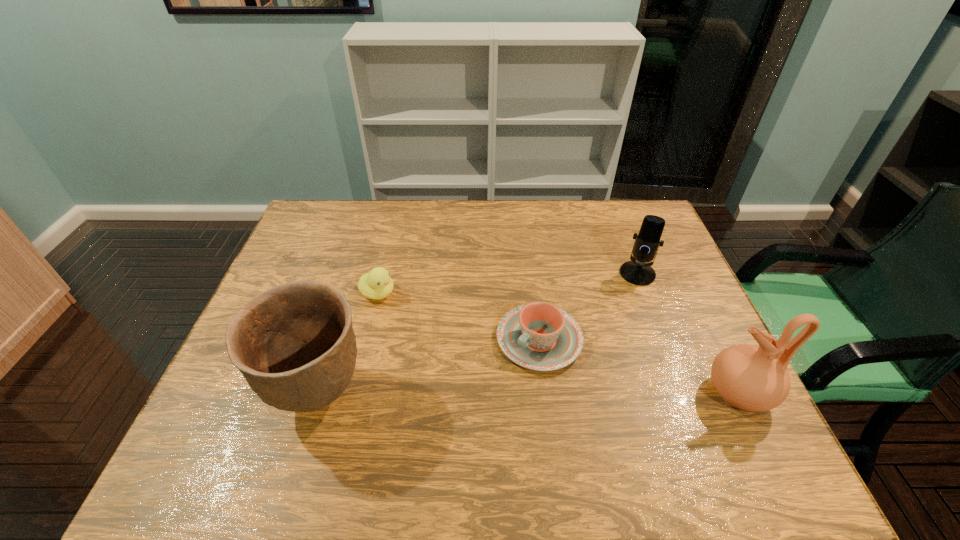
Locate an element on the screen. Image resolution: width=960 pixels, height=540 pixels. free point that satisfies the following two spatial constraints: 1. on the front side of the right pottery; 2. on the spout of the duckling is located at coordinates (353, 393).

The width and height of the screenshot is (960, 540). Find the location of `free location that satisfies the following two spatial constraints: 1. on the back side of the fourth object from left to right; 2. on the right side of the chinaware`. free location that satisfies the following two spatial constraints: 1. on the back side of the fourth object from left to right; 2. on the right side of the chinaware is located at coordinates (531, 274).

The width and height of the screenshot is (960, 540). What are the coordinates of `free location that satisfies the following two spatial constraints: 1. on the front side of the duckling; 2. on the spout of the rightmost object` in the screenshot? It's located at (353, 393).

The image size is (960, 540). Find the location of `free spot that satisfies the following two spatial constraints: 1. on the back side of the third shortest object; 2. on the left side of the third object from left to right`. free spot that satisfies the following two spatial constraints: 1. on the back side of the third shortest object; 2. on the left side of the third object from left to right is located at coordinates (531, 274).